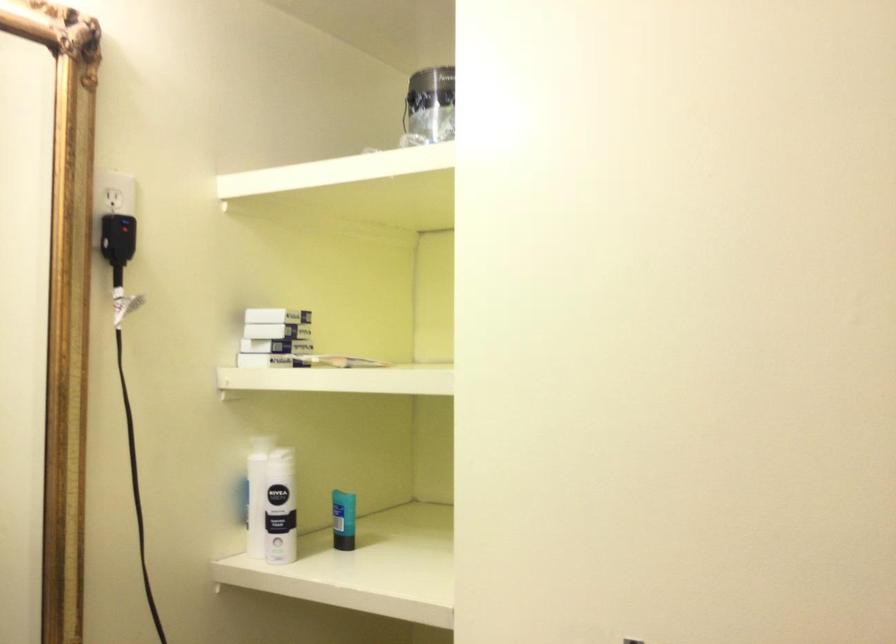
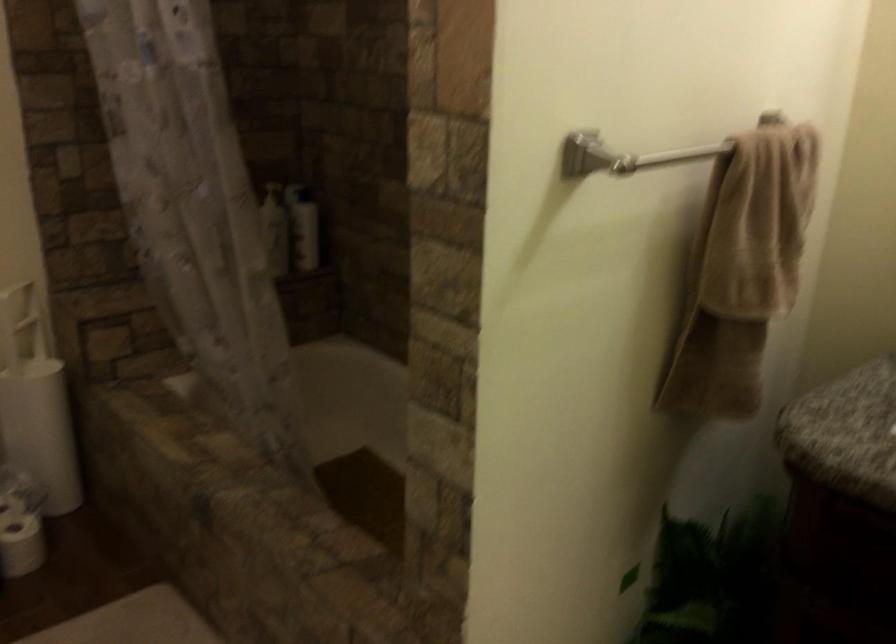
The images are taken continuously from a first-person perspective. In which direction is your viewpoint rotating?

The camera rotated toward left-down.